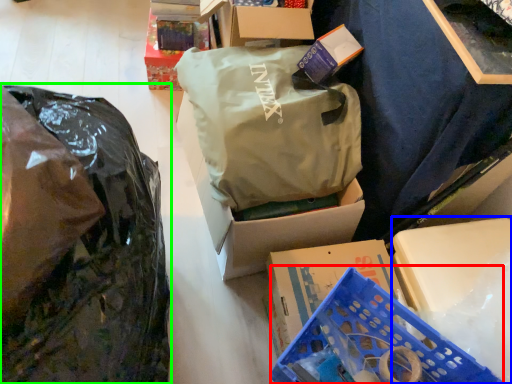
Question: Estimate the real-world distances between objects in this image. Which object is farther from basket (highlighted by a red box), storage box (highlighted by a blue box) or plastic bag (highlighted by a green box)?

Choices:
 (A) storage box
 (B) plastic bag

Answer: (B)